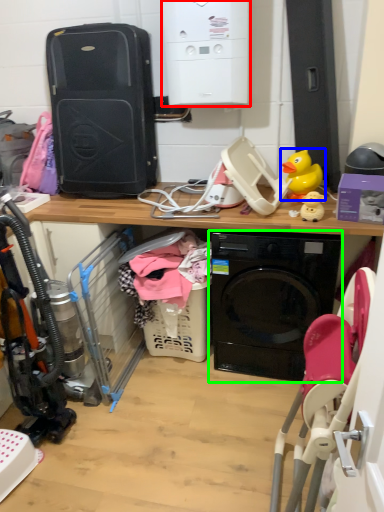
Question: Which object is the farthest from appliance (highlighted by a red box)? Choose among these: toy (highlighted by a blue box) or washing machine (highlighted by a green box).

Choices:
 (A) toy
 (B) washing machine

Answer: (B)